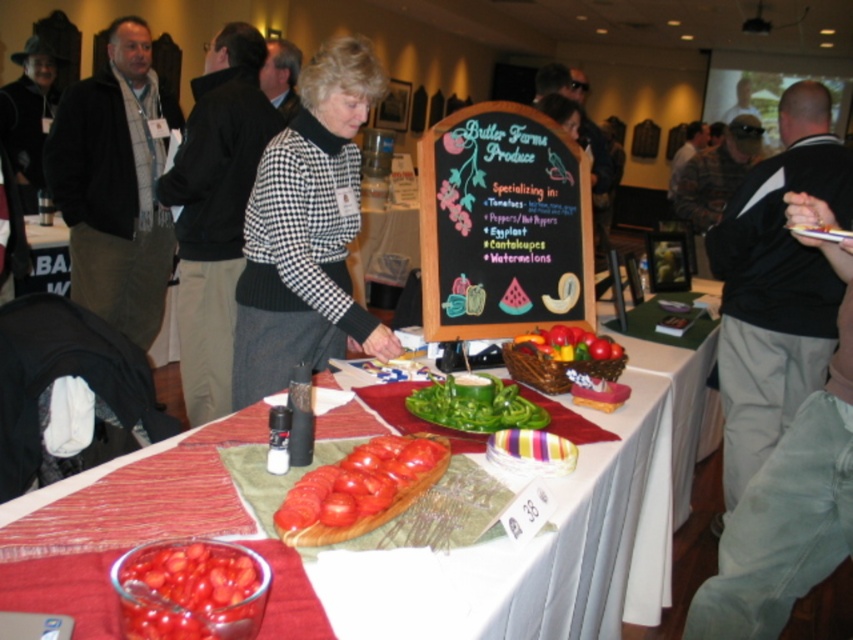
Is glossy glass bowl at lower left wider than green smoothmaterial/texture at center?

Incorrect, glossy glass bowl at lower left's width does not surpass green smoothmaterial/texture at center's.

Between point (218, 632) and point (421, 396), which one is positioned in front?

Positioned in front is point (218, 632).

Where is `glossy glass bowl at lower left`? glossy glass bowl at lower left is located at coordinates (190, 589).

Does red fabric tablecloth at center come behind green smoothmaterial/texture at center?

No, red fabric tablecloth at center is closer to the viewer.

Does point (602, 634) come farther from viewer compared to point (526, 416)?

That is True.

What are the coordinates of `red fabric tablecloth at center` in the screenshot? It's located at (535, 552).

Locate an element on the screen. The height and width of the screenshot is (640, 853). red fabric tablecloth at center is located at coordinates (535, 552).

Does black chalkboard at center have a smaller size compared to black sweater at upper right?

Yes.

Is point (447, 166) behind point (764, 320)?

That is False.

Locate an element on the screen. black chalkboard at center is located at coordinates (502, 225).